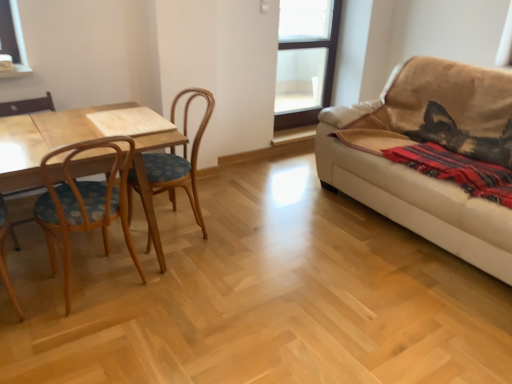
Question: From a real-world perspective, is woodenchair at left physically below red woven blanket at right?

Choices:
 (A) no
 (B) yes

Answer: (B)

Question: Can you confirm if woodenchair at left is positioned to the right of red woven blanket at right?

Choices:
 (A) yes
 (B) no

Answer: (B)

Question: Is woodenchair at left bigger than red woven blanket at right?

Choices:
 (A) no
 (B) yes

Answer: (B)

Question: Is woodenchair at left touching red woven blanket at right?

Choices:
 (A) no
 (B) yes

Answer: (A)

Question: Could red woven blanket at right be considered to be inside woodenchair at left?

Choices:
 (A) yes
 (B) no

Answer: (B)

Question: From a real-world perspective, is beige fabric couch at right above or below wooden chair at left?

Choices:
 (A) above
 (B) below

Answer: (A)

Question: Based on their sizes in the image, would you say beige fabric couch at right is bigger or smaller than wooden chair at left?

Choices:
 (A) big
 (B) small

Answer: (A)

Question: Considering the positions of beige fabric couch at right and wooden chair at left in the image, is beige fabric couch at right taller or shorter than wooden chair at left?

Choices:
 (A) short
 (B) tall

Answer: (B)

Question: Is beige fabric couch at right situated inside wooden chair at left or outside?

Choices:
 (A) outside
 (B) inside

Answer: (A)

Question: From a real-world perspective, is wooden chair at left physically located above or below woodenchair at left?

Choices:
 (A) above
 (B) below

Answer: (A)

Question: Based on their sizes in the image, would you say wooden chair at left is bigger or smaller than woodenchair at left?

Choices:
 (A) big
 (B) small

Answer: (B)

Question: Considering the positions of point (12, 107) and point (159, 173), is point (12, 107) closer or farther from the camera than point (159, 173)?

Choices:
 (A) closer
 (B) farther

Answer: (B)

Question: Would you say wooden chair at left is to the left or to the right of woodenchair at left in the picture?

Choices:
 (A) right
 (B) left

Answer: (B)

Question: Considering their positions, is wooden chair at left located in front of or behind beige fabric couch at right?

Choices:
 (A) front
 (B) behind

Answer: (A)

Question: From the image's perspective, relative to beige fabric couch at right, is wooden chair at left above or below?

Choices:
 (A) below
 (B) above

Answer: (A)